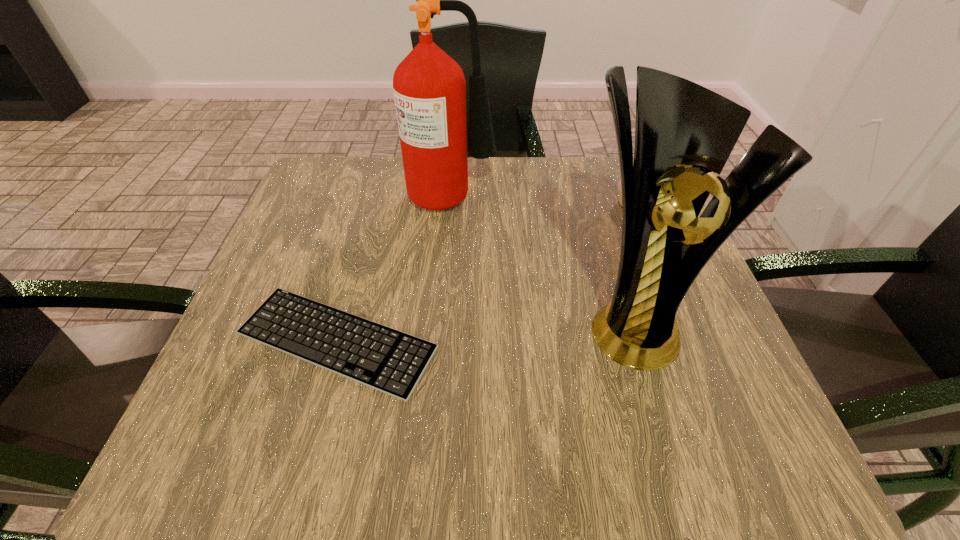
In the image, there is a desktop. Identify the location of free space at the near right corner. (692, 471).

Identify the location of blank region between the fire extinguisher and the award. Image resolution: width=960 pixels, height=540 pixels. (541, 256).

The height and width of the screenshot is (540, 960). Find the location of `empty location between the cupcake and the fire extinguisher`. empty location between the cupcake and the fire extinguisher is located at coordinates (543, 199).

Locate an element on the screen. free point between the shortest object and the third tallest object is located at coordinates (485, 272).

Image resolution: width=960 pixels, height=540 pixels. Identify the location of vacant area that lies between the fire extinguisher and the cupcake. (543, 199).

The height and width of the screenshot is (540, 960). What are the coordinates of `free area in between the fire extinguisher and the cupcake` in the screenshot? It's located at (543, 199).

At what (x,y) coordinates should I click in order to perform the action: click on vacant region between the computer keyboard and the award. Please return your answer as a coordinate pair (x, y). Looking at the image, I should click on (483, 330).

You are a GUI agent. You are given a task and a screenshot of the screen. Output one action in this format:
    pyautogui.click(x=<x>, y=<y>)
    Task: Click on the free space between the fire extinguisher and the third tallest object
    Image resolution: width=960 pixels, height=540 pixels.
    Given the screenshot: What is the action you would take?
    pyautogui.click(x=543, y=199)

Where is `vacant area that lies between the cupcake and the fire extinguisher`? The height and width of the screenshot is (540, 960). vacant area that lies between the cupcake and the fire extinguisher is located at coordinates (x=543, y=199).

Locate an element on the screen. object that is the third closest to the cupcake is located at coordinates coord(380,357).